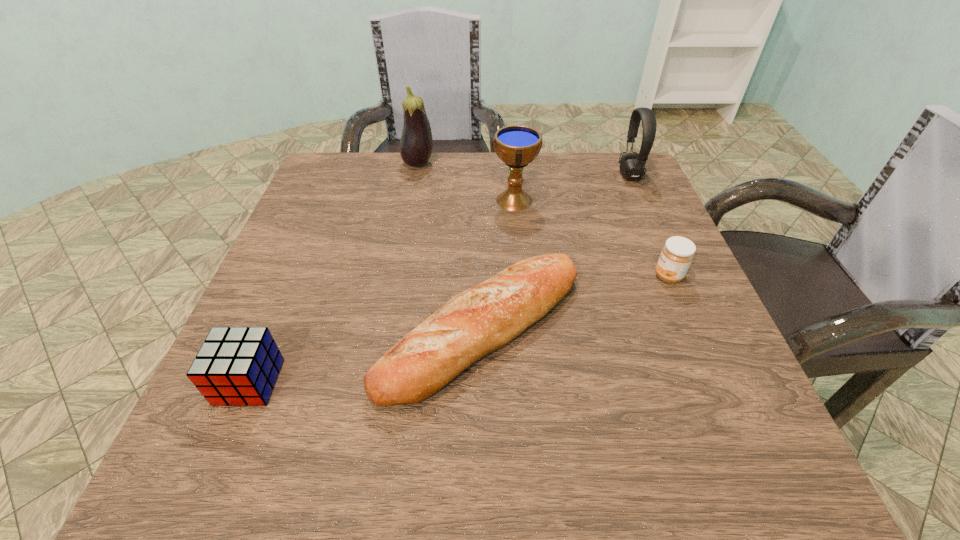
Find the location of a particular element. This screenshot has width=960, height=540. eggplant is located at coordinates (416, 144).

Locate an element on the screen. The width and height of the screenshot is (960, 540). headset is located at coordinates (632, 165).

Find the location of a particular element. The width and height of the screenshot is (960, 540). chalice is located at coordinates (516, 145).

Where is `baguet`? This screenshot has height=540, width=960. baguet is located at coordinates (484, 318).

Where is `cube`? cube is located at coordinates (238, 366).

Locate an element on the screen. Image resolution: width=960 pixels, height=540 pixels. jam is located at coordinates (676, 256).

Find the location of a particular element. free point located 0.070m on the front of the eggplant is located at coordinates (414, 187).

Where is `vacant space located 0.380m on the front-facing side of the headset`? Image resolution: width=960 pixels, height=540 pixels. vacant space located 0.380m on the front-facing side of the headset is located at coordinates (473, 176).

Where is `free space located on the front-facing side of the headset`? Image resolution: width=960 pixels, height=540 pixels. free space located on the front-facing side of the headset is located at coordinates [x=565, y=176].

Image resolution: width=960 pixels, height=540 pixels. I want to click on vacant space located 0.190m on the front-facing side of the headset, so click(546, 176).